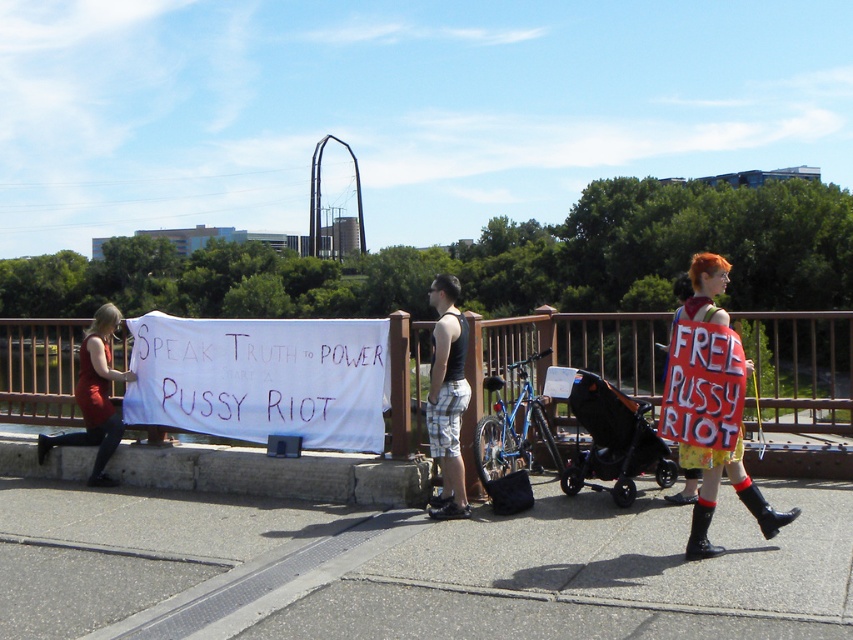
You are a photographer standing at the edge of the bridge. You want to take a photo that includes both the black mesh tank top at center and the matte red dress at left. The camera has a maximum zoom range of 10 meters. Can you capture both subjects in a single frame without moving your position?

The black mesh tank top at center and the matte red dress at left are 13.14 meters apart from each other. Since the camera can only zoom up to 10 meters, the distance between them exceeds the maximum zoom range. Therefore, you cannot capture both subjects in a single frame without moving your position.

What is the location of the point at coordinates (416, 566) in the image?

The point at coordinates (416, 566) is located on the gray asphalt at lower center.

You are a photographer trying to capture the protest scene. You notice the black mesh tank top at center and the matte red dress at left. Which of these two clothing items appears narrower in the photo?

The black mesh tank top at center appears narrower than the matte red dress at left because its width is less than the dress.